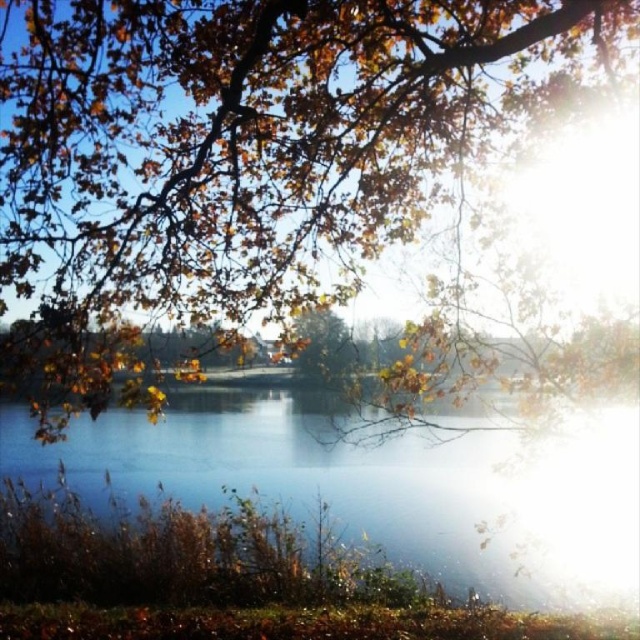
Can you confirm if golden leafy branches at upper center is smaller than clear water at center?

Yes, golden leafy branches at upper center is smaller than clear water at center.

Between point (464, 138) and point (42, 464), which one is positioned behind?

Point (42, 464)

This screenshot has width=640, height=640. I want to click on golden leafy branches at upper center, so click(234, 150).

Find the location of `golden leafy branches at upper center`. golden leafy branches at upper center is located at coordinates [x=234, y=150].